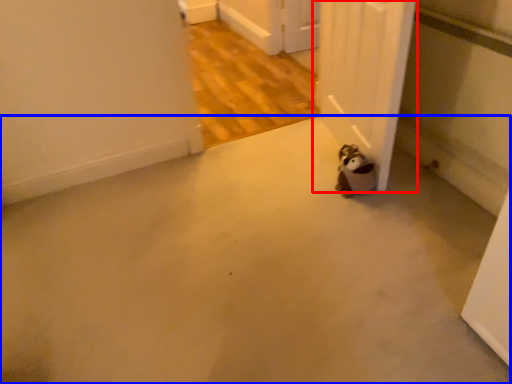
Question: Which point is closer to the camera, door (highlighted by a red box) or concrete (highlighted by a blue box)?

Choices:
 (A) door
 (B) concrete

Answer: (B)